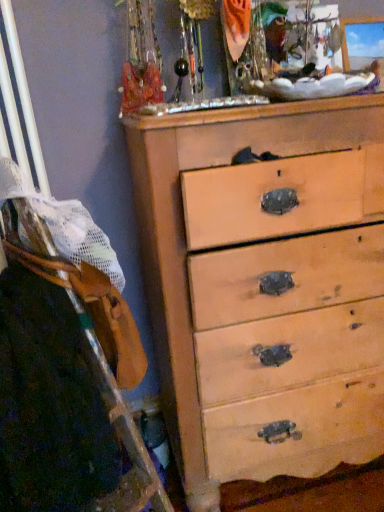
Question: Is wooden ladder at left further to the viewer compared to light wood chest of drawers at center?

Choices:
 (A) yes
 (B) no

Answer: (B)

Question: Is the depth of wooden ladder at left less than that of light wood chest of drawers at center?

Choices:
 (A) no
 (B) yes

Answer: (B)

Question: Can you confirm if wooden ladder at left is positioned to the right of light wood chest of drawers at center?

Choices:
 (A) no
 (B) yes

Answer: (A)

Question: From a real-world perspective, does wooden ladder at left sit lower than light wood chest of drawers at center?

Choices:
 (A) yes
 (B) no

Answer: (B)

Question: Is wooden ladder at left facing towards light wood chest of drawers at center?

Choices:
 (A) yes
 (B) no

Answer: (B)

Question: Is wooden ladder at left facing away from light wood chest of drawers at center?

Choices:
 (A) yes
 (B) no

Answer: (B)

Question: From a real-world perspective, is light wood chest of drawers at center over wooden ladder at left?

Choices:
 (A) no
 (B) yes

Answer: (A)

Question: Can you confirm if light wood chest of drawers at center is shorter than wooden ladder at left?

Choices:
 (A) no
 (B) yes

Answer: (A)

Question: Could wooden ladder at left be considered to be inside light wood chest of drawers at center?

Choices:
 (A) no
 (B) yes

Answer: (A)

Question: Is light wood chest of drawers at center in contact with wooden ladder at left?

Choices:
 (A) no
 (B) yes

Answer: (A)

Question: Does light wood chest of drawers at center appear on the right side of wooden ladder at left?

Choices:
 (A) no
 (B) yes

Answer: (B)

Question: Can you confirm if light wood chest of drawers at center is taller than wooden ladder at left?

Choices:
 (A) no
 (B) yes

Answer: (B)

Question: Does point (167, 197) appear closer or farther from the camera than point (59, 459)?

Choices:
 (A) closer
 (B) farther

Answer: (B)